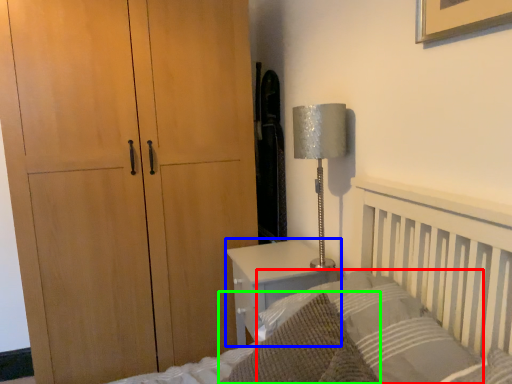
Question: Which object is positioned farthest from pillow (highlighted by a red box)? Select from nightstand (highlighted by a blue box) and throw pillow (highlighted by a green box).

Choices:
 (A) nightstand
 (B) throw pillow

Answer: (A)